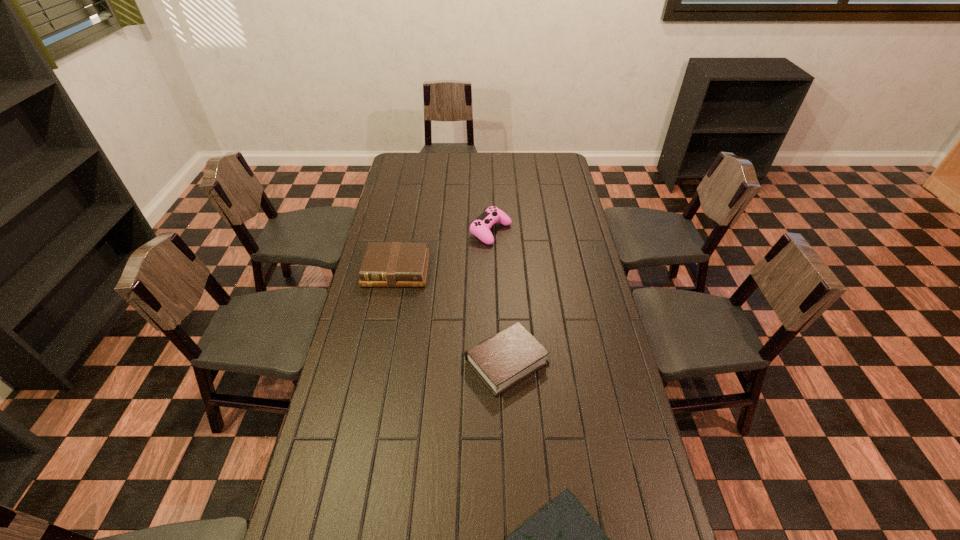
Locate an element on the screen. This screenshot has width=960, height=540. free spot at the right edge of the desktop is located at coordinates (551, 240).

Locate an element on the screen. vacant space that's between the leftmost Bible and the second nearest Bible is located at coordinates (451, 316).

The height and width of the screenshot is (540, 960). Identify the location of vacant space in between the third farthest object and the farthest object. (499, 296).

In order to click on empty space that is in between the third farthest object and the control in this screenshot , I will do `click(499, 296)`.

This screenshot has width=960, height=540. Identify the location of free space between the third farthest object and the farthest Bible. (451, 316).

You are a GUI agent. You are given a task and a screenshot of the screen. Output one action in this format:
    pyautogui.click(x=<x>, y=<y>)
    Task: Click on the vacant area between the second nearest object and the second farthest object
    The height and width of the screenshot is (540, 960).
    Given the screenshot: What is the action you would take?
    pyautogui.click(x=451, y=316)

The image size is (960, 540). In order to click on the closest object to the second nearest object in this screenshot , I will do `click(386, 264)`.

The height and width of the screenshot is (540, 960). I want to click on the closest object relative to the second nearest Bible, so click(x=386, y=264).

Locate an element on the screen. the second closest Bible to the farthest Bible is located at coordinates (562, 539).

Find the location of a particular element. This screenshot has height=540, width=960. Bible that stands as the second closest to the leftmost object is located at coordinates (562, 539).